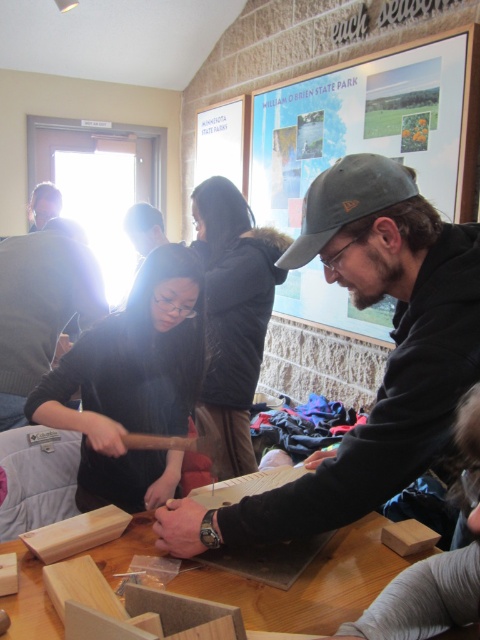
Question: Can you confirm if matte black sweater at center is positioned to the right of black fuzzy coat at center?

Choices:
 (A) no
 (B) yes

Answer: (A)

Question: Observing the image, what is the correct spatial positioning of black fuzzy coat at center in reference to dark blue fabric at center?

Choices:
 (A) right
 (B) left

Answer: (B)

Question: Which object appears closest to the camera in this image?

Choices:
 (A) matte black sweater at center
 (B) dark blue fabric at center
 (C) matte black cap at center
 (D) natural wood table at center

Answer: (C)

Question: Which point is farther to the camera?

Choices:
 (A) matte black cap at center
 (B) dark blue fabric at center
 (C) matte black sweater at center
 (D) black fuzzy coat at center

Answer: (B)

Question: In this image, where is matte black cap at center located relative to natural wood table at center?

Choices:
 (A) above
 (B) below

Answer: (A)

Question: Which of the following is the farthest from the observer?

Choices:
 (A) (256, 342)
 (B) (442, 355)

Answer: (A)